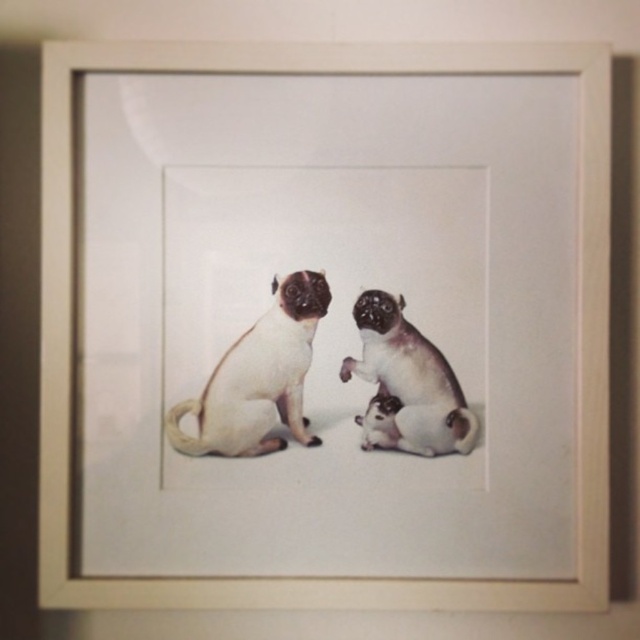
Which is in front, point (273, 444) or point (424, 440)?

Point (424, 440)

Is smooth beige pug at center bigger than smooth white dog at lower right?

Yes.

From the picture: Measure the distance between smooth beige pug at center and camera.

smooth beige pug at center is 35.65 inches from camera.

Identify the location of smooth beige pug at center. The image size is (640, 640). (259, 378).